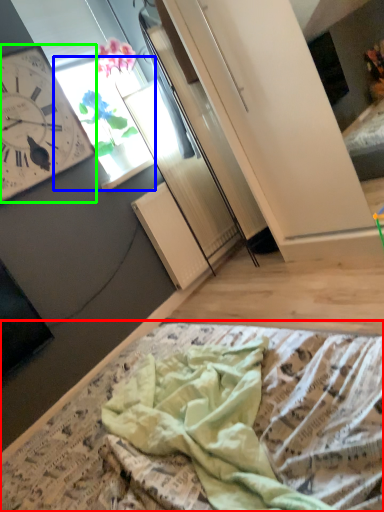
Question: Which object is positioned farthest from blanket (highlighted by a red box)? Select from window (highlighted by a blue box) and wall clock (highlighted by a green box).

Choices:
 (A) window
 (B) wall clock

Answer: (A)